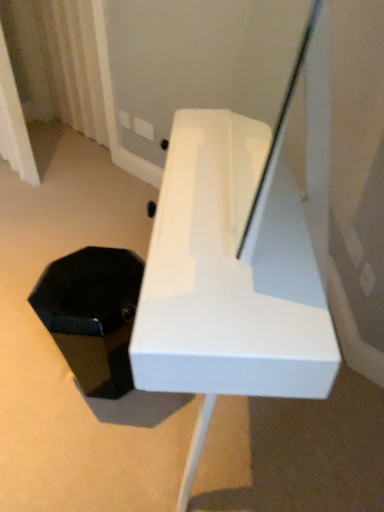
Find the location of a particular element. unoccupied area in front of black matte hexagonal box at lower left is located at coordinates (96, 432).